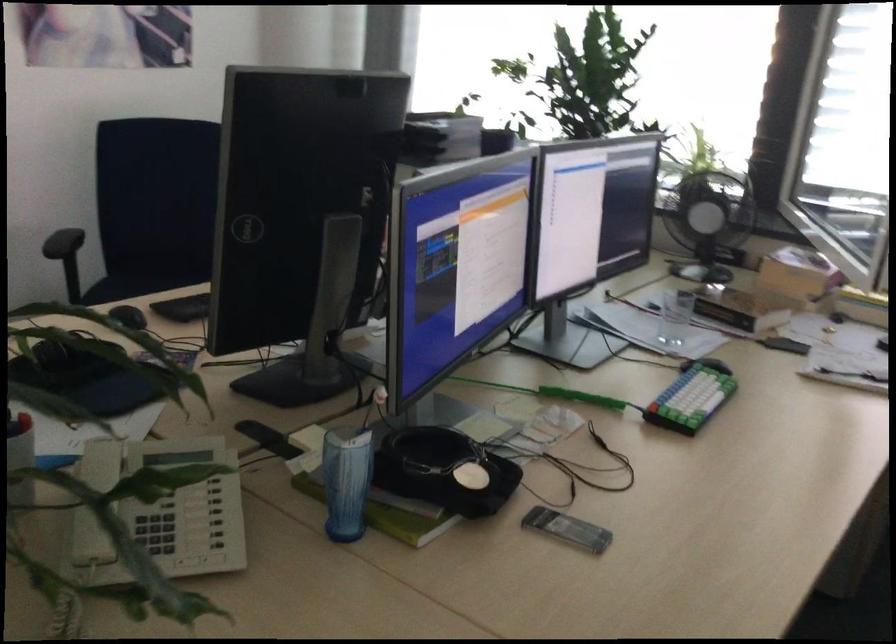
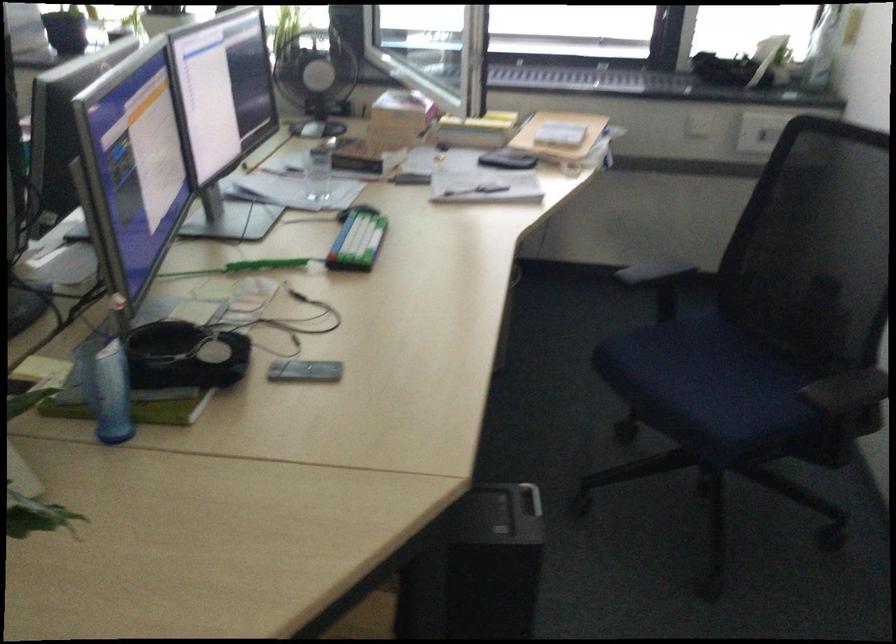
The point at (348, 488) is marked in the first image. Where is the corresponding point in the second image?

(110, 393)